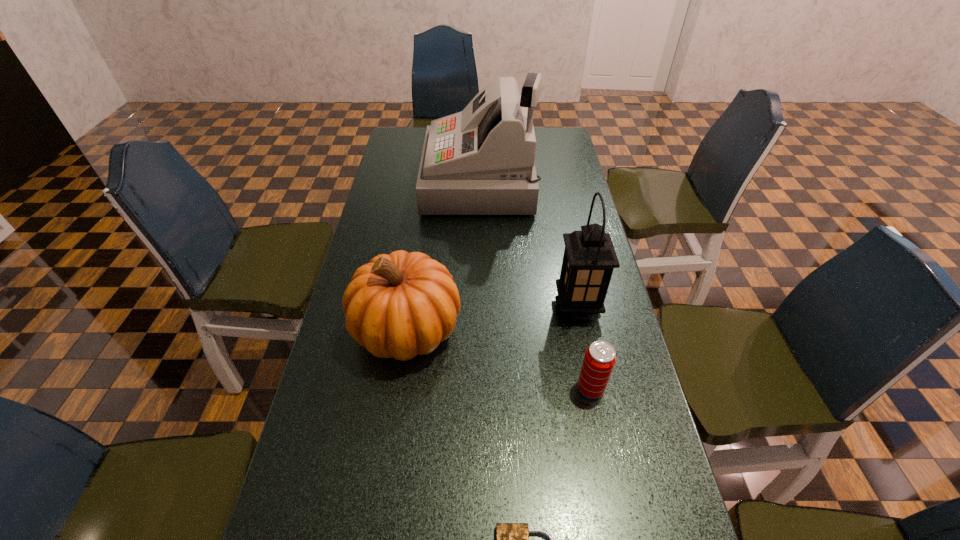
Locate an element on the screen. This screenshot has height=540, width=960. the farthest object is located at coordinates (481, 161).

Locate an element on the screen. The height and width of the screenshot is (540, 960). the fourth shortest object is located at coordinates (589, 259).

Find the location of `the third tallest object`. the third tallest object is located at coordinates (403, 304).

Identify the location of soda can. (599, 360).

The image size is (960, 540). Find the location of `the fourth tallest object`. the fourth tallest object is located at coordinates (599, 360).

Find the location of `vacant space situated 0.100m on the keypad side of the cash register`. vacant space situated 0.100m on the keypad side of the cash register is located at coordinates (397, 182).

This screenshot has height=540, width=960. What are the coordinates of `vacant space located 0.160m on the keypad side of the cash register` in the screenshot? It's located at (381, 182).

Identify the location of vacant region located on the keypad side of the cash register. This screenshot has height=540, width=960. (411, 182).

What are the coordinates of `vacant point located on the front of the lantern` in the screenshot? It's located at (588, 353).

Find the location of a particular element. This screenshot has height=540, width=960. vacant space located 0.170m on the back of the pumpkin is located at coordinates (419, 250).